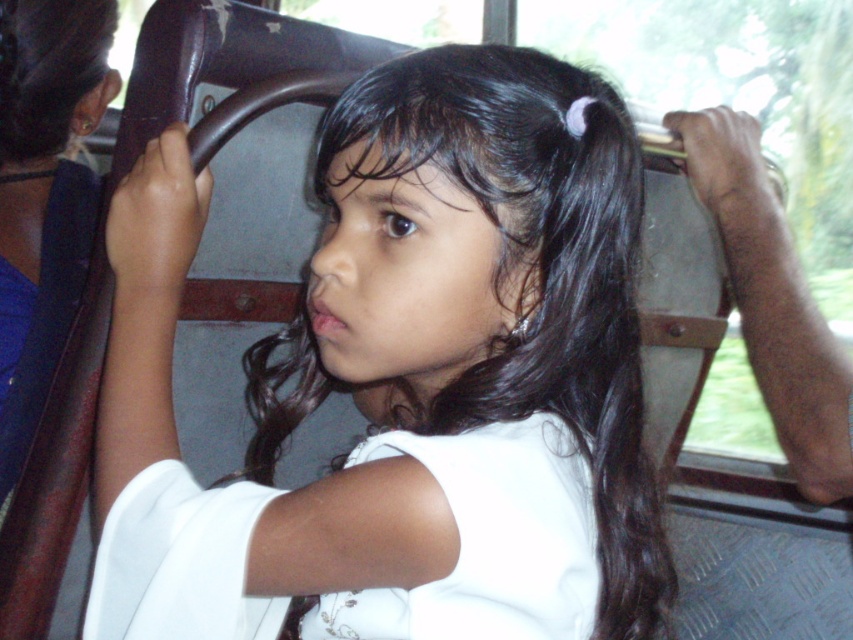
You are a passenger on a train and see the black hair at center and the metallic gray coach at right. Which object is wider from your perspective?

The black hair at center is wider than the metallic gray coach at right according to the description.

You are a passenger on a train and want to know if there is enough space between your black hair at center and the metallic gray coach at right to safely move your head sideways. Can you determine if there is enough space?

The black hair at center and metallic gray coach at right are 15.70 inches apart, which provides sufficient space for a passenger to safely move their head sideways without any risk of collision.

You are standing at the point marked as point (x=393, y=348) in the image. You want to reach a button located 30 inches away from your current position. Can you reach it without moving your feet?

The distance between you and the viewer is 26.76 inches. Since the button is 30 inches away, you cannot reach it without moving your feet.